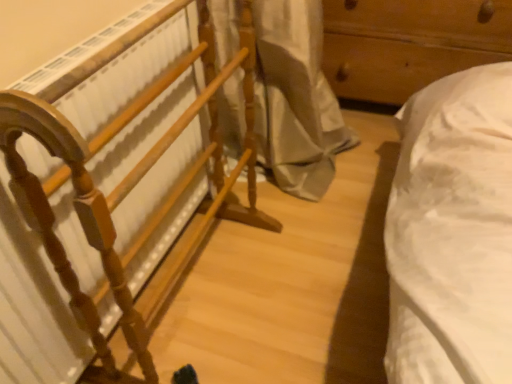
Question: Considering the positions of wooden drawer at right, which is the 2th furniture in left-to-right order, and wooden rack at left, placed as the 1th furniture when sorted from front to back, in the image, is wooden drawer at right, which is the 2th furniture in left-to-right order, wider or thinner than wooden rack at left, placed as the 1th furniture when sorted from front to back,?

Choices:
 (A) thin
 (B) wide

Answer: (B)

Question: Does point (372, 36) appear closer or farther from the camera than point (156, 87)?

Choices:
 (A) farther
 (B) closer

Answer: (A)

Question: Relative to wooden rack at left, placed as the 1th furniture when sorted from front to back, is wooden drawer at right, which is the 2th furniture in left-to-right order, in front or behind?

Choices:
 (A) front
 (B) behind

Answer: (B)

Question: Based on their sizes in the image, would you say wooden rack at left, the second furniture from the right, is bigger or smaller than wooden drawer at right, which is counted as the first furniture, starting from the right?

Choices:
 (A) big
 (B) small

Answer: (B)

Question: Is wooden rack at left, the second furniture from the right, inside or outside of wooden drawer at right, which is counted as the first furniture, starting from the right?

Choices:
 (A) inside
 (B) outside

Answer: (B)

Question: Is wooden rack at left, which is counted as the 2th furniture, starting from the back, wider or thinner than wooden drawer at right, which is the 2th furniture in left-to-right order?

Choices:
 (A) thin
 (B) wide

Answer: (A)

Question: From a real-world perspective, is wooden rack at left, the second furniture from the right, physically located above or below wooden drawer at right, which is the 2th furniture in left-to-right order?

Choices:
 (A) above
 (B) below

Answer: (A)